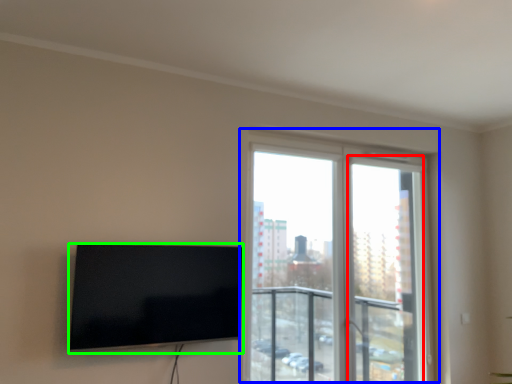
Question: Estimate the real-world distances between objects in this image. Which object is farther from screen door (highlighted by a red box), window (highlighted by a blue box) or television (highlighted by a green box)?

Choices:
 (A) window
 (B) television

Answer: (B)